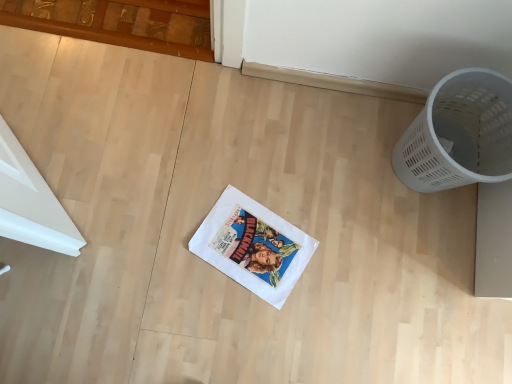
Identify the location of vacant space underneath white paper comic book at center (from a real-world perspective). (255, 250).